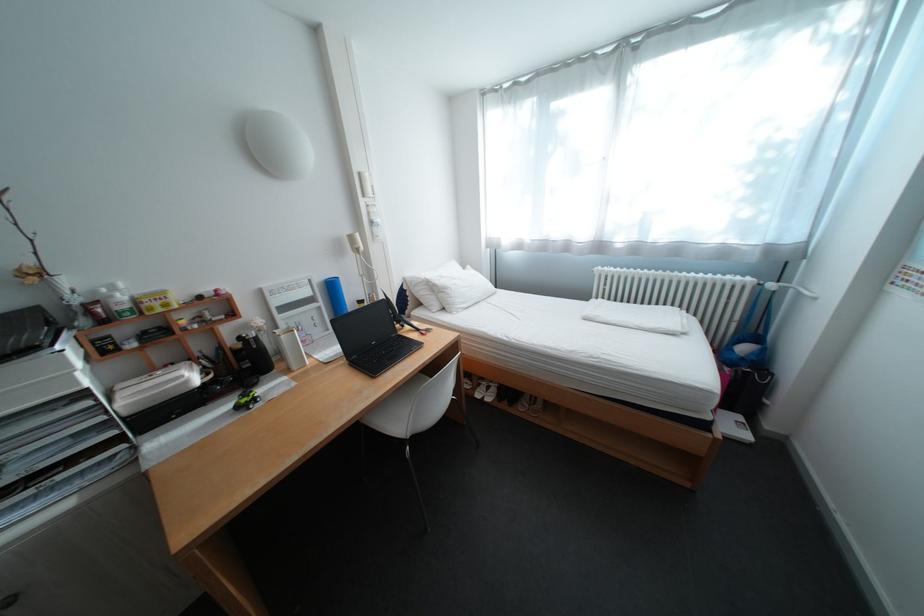
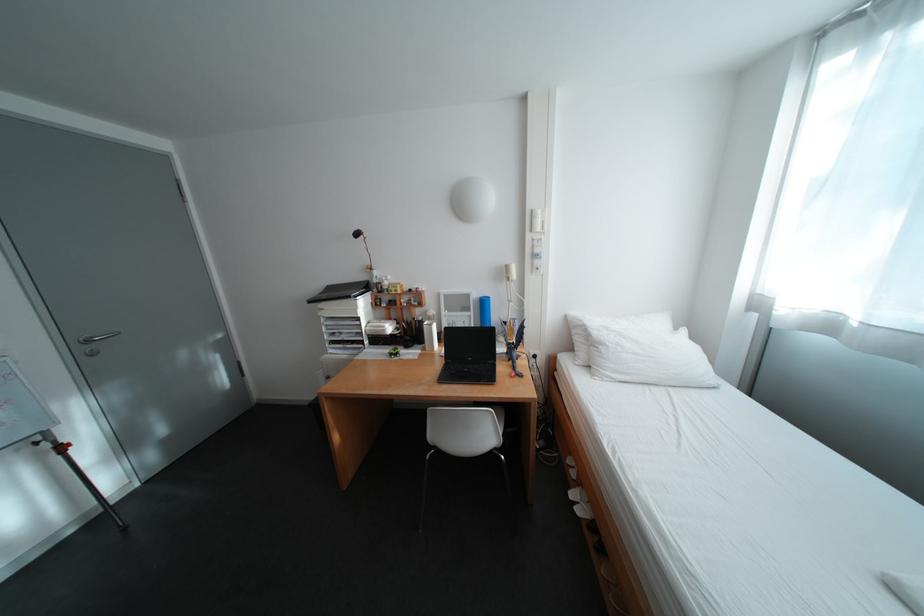
Where in the second image is the point corresponding to pixel 371 175 from the first image?

(544, 213)